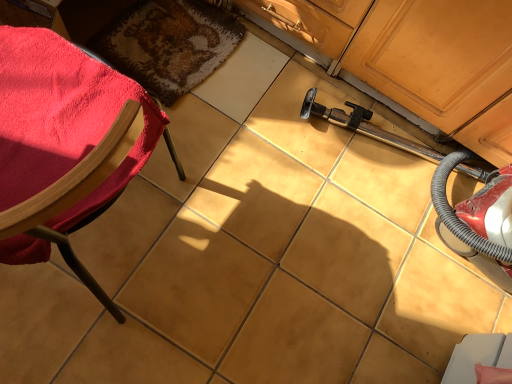
The height and width of the screenshot is (384, 512). In order to click on vacant area that lies to the right of velvet red chair at left in this screenshot , I will do `click(229, 280)`.